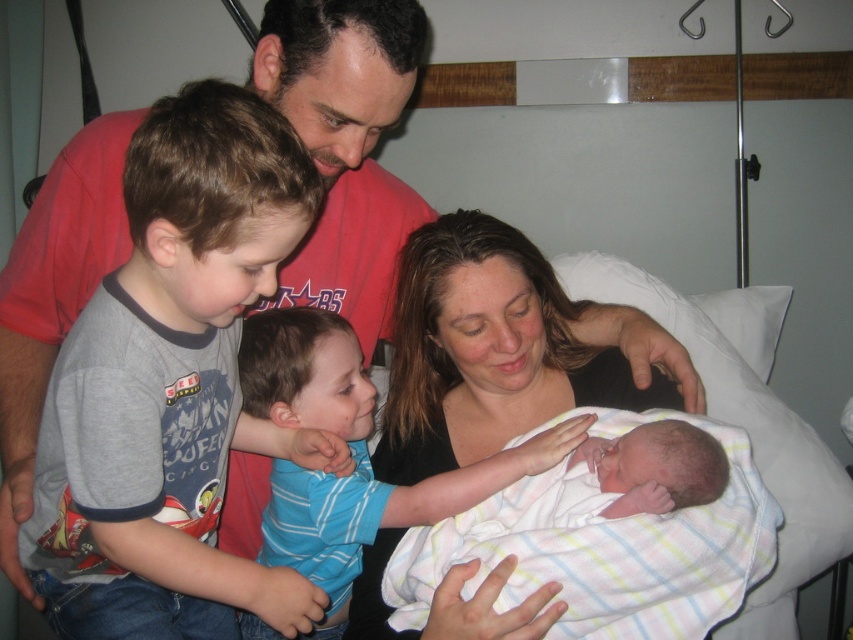
Question: Is gray cotton shirt at left positioned at the back of blue striped shirt at center?

Choices:
 (A) no
 (B) yes

Answer: (A)

Question: Does gray cotton shirt at left appear under smooth black shirt at center?

Choices:
 (A) yes
 (B) no

Answer: (B)

Question: Which point appears closest to the camera in this image?

Choices:
 (A) (405, 396)
 (B) (370, 512)
 (C) (410, 584)
 (D) (88, 557)

Answer: (D)

Question: Which object appears closest to the camera in this image?

Choices:
 (A) gray cotton shirt at left
 (B) blue striped shirt at center
 (C) smooth black shirt at center

Answer: (A)

Question: Is gray cotton shirt at left bigger than soft white swaddling blanket at center?

Choices:
 (A) no
 (B) yes

Answer: (B)

Question: Which object is the farthest from the gray cotton shirt at left?

Choices:
 (A) smooth black shirt at center
 (B) soft white swaddling blanket at center

Answer: (A)